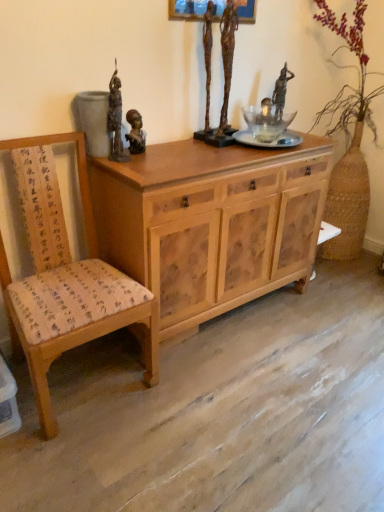
Where is `empty space that is to the right of wooden chair with fabric cushion at left`? The height and width of the screenshot is (512, 384). empty space that is to the right of wooden chair with fabric cushion at left is located at coordinates (207, 401).